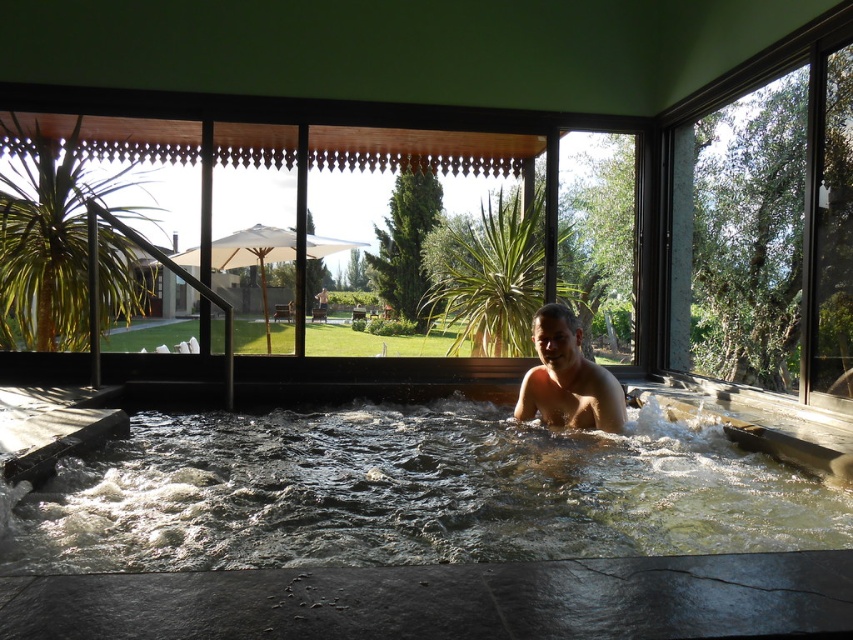
Question: Which point is farther from the camera taking this photo?

Choices:
 (A) (590, 404)
 (B) (352, 518)

Answer: (A)

Question: Is clear water at center to the left of smooth tan skin at center from the viewer's perspective?

Choices:
 (A) no
 (B) yes

Answer: (B)

Question: Can you confirm if clear water at center is positioned above smooth tan skin at center?

Choices:
 (A) no
 (B) yes

Answer: (A)

Question: Which point appears closest to the camera in this image?

Choices:
 (A) (572, 448)
 (B) (563, 349)

Answer: (A)

Question: Does clear water at center have a smaller size compared to smooth tan skin at center?

Choices:
 (A) no
 (B) yes

Answer: (A)